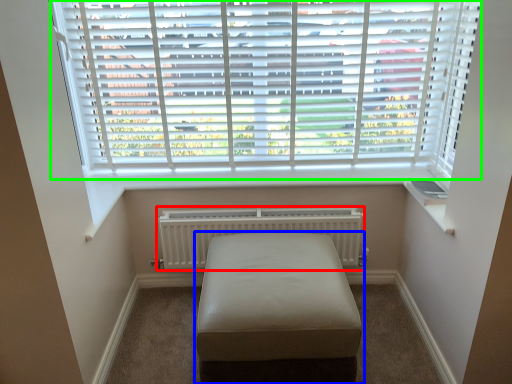
Question: Considering the real-world distances, which object is closest to radiator (highlighted by a red box)? furniture (highlighted by a blue box) or window blind (highlighted by a green box).

Choices:
 (A) furniture
 (B) window blind

Answer: (A)